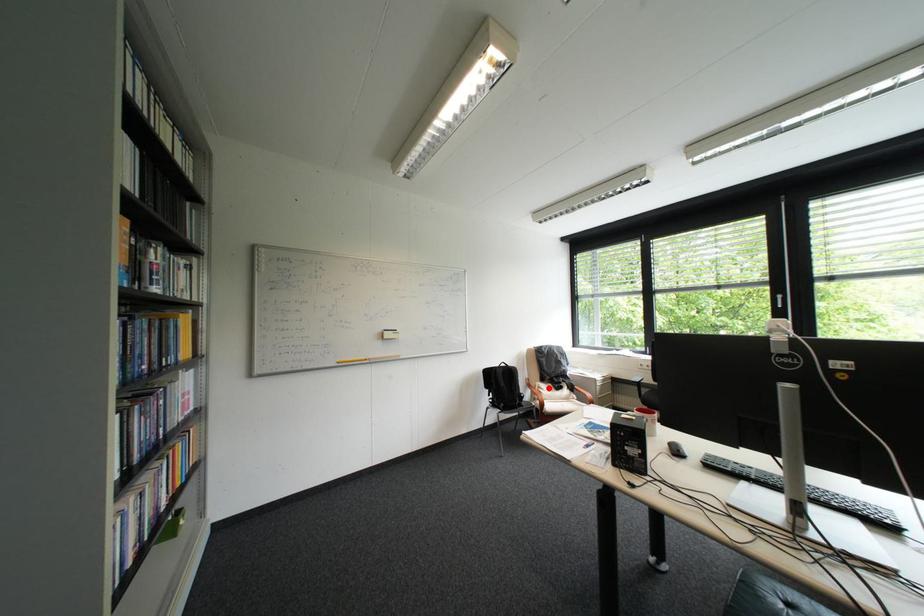
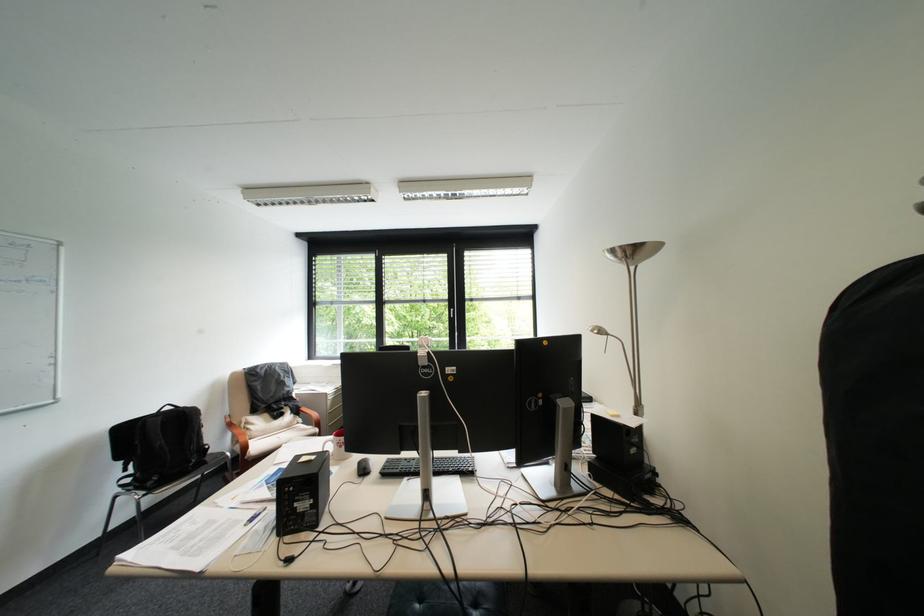
Question: I am providing you with two images of the same scene from different viewpoints. A red point is marked on the first image. At the location where the point appears in image 1, is it still visible in image 2?

Choices:
 (A) Yes
 (B) No

Answer: (A)